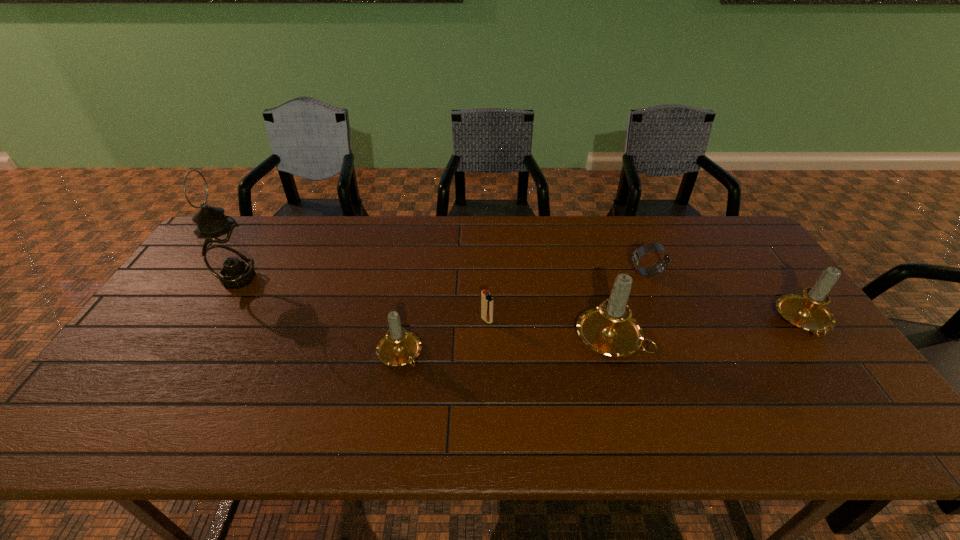
Find the location of `blank region between the tallest object and the igniter`. blank region between the tallest object and the igniter is located at coordinates (363, 299).

You are a GUI agent. You are given a task and a screenshot of the screen. Output one action in this format:
    pyautogui.click(x=<x>, y=<y>)
    Task: Click on the free space between the fourth object from right to left and the watch
    The width and height of the screenshot is (960, 540).
    Given the screenshot: What is the action you would take?
    point(567,296)

Find the location of a particular element. free point between the fourth object from right to left and the tallest object is located at coordinates (363, 299).

The image size is (960, 540). I want to click on free space that is in between the watch and the oil lamp, so click(x=443, y=276).

Image resolution: width=960 pixels, height=540 pixels. Identify the location of unoccupied area between the igniter and the watch. pos(567,296).

At what (x,y) coordinates should I click in order to perform the action: click on free point between the fifth shortest object and the leftmost object. Please return your answer as a coordinate pair (x, y). The width and height of the screenshot is (960, 540). Looking at the image, I should click on (423, 308).

Image resolution: width=960 pixels, height=540 pixels. Find the location of `free space between the leftmost object and the tallest candle`. free space between the leftmost object and the tallest candle is located at coordinates (423, 308).

This screenshot has width=960, height=540. Find the location of `object that stands as the second closest to the second shortest candle`. object that stands as the second closest to the second shortest candle is located at coordinates (609, 329).

The height and width of the screenshot is (540, 960). In order to click on object that is the fourth nearest to the fourth tallest object in this screenshot , I will do `click(636, 257)`.

Find the location of a particular element. The height and width of the screenshot is (540, 960). candle that stands as the second closest to the tallest object is located at coordinates (609, 329).